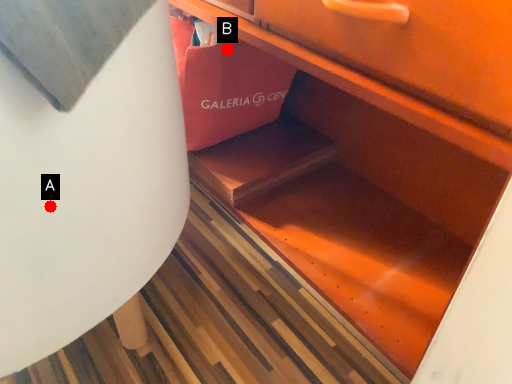
Question: Two points are circled on the image, labeled by A and B beside each circle. Which of the following is the closest to the observer?

Choices:
 (A) A is closer
 (B) B is closer

Answer: (A)